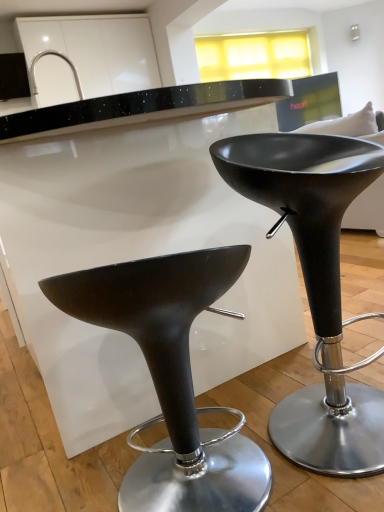
This screenshot has width=384, height=512. Describe the element at coordinates (172, 378) in the screenshot. I see `matte black stool at lower left, marked as the 1th stool in a left-to-right arrangement` at that location.

Image resolution: width=384 pixels, height=512 pixels. What are the coordinates of `matte black stool at center, acting as the second stool starting from the left` in the screenshot? It's located at (316, 286).

Identify the location of satin nickel faucet at upper left. The width and height of the screenshot is (384, 512). (56, 56).

The height and width of the screenshot is (512, 384). Find the location of `matte black stool at lower left, which ranks as the second stool in right-to-left order`. matte black stool at lower left, which ranks as the second stool in right-to-left order is located at coordinates (172, 378).

Is matte black stool at lower left, which ranks as the second stool in right-to-left order, aimed at satin nickel faucet at upper left?

No, matte black stool at lower left, which ranks as the second stool in right-to-left order, is not aimed at satin nickel faucet at upper left.

In terms of height, does matte black stool at lower left, marked as the 1th stool in a left-to-right arrangement, look taller or shorter compared to satin nickel faucet at upper left?

Clearly, matte black stool at lower left, marked as the 1th stool in a left-to-right arrangement, is taller compared to satin nickel faucet at upper left.

Is matte black stool at lower left, marked as the 1th stool in a left-to-right arrangement, in front of or behind satin nickel faucet at upper left in the image?

Clearly, matte black stool at lower left, marked as the 1th stool in a left-to-right arrangement, is in front of satin nickel faucet at upper left.

Can you confirm if matte black stool at lower left, marked as the 1th stool in a left-to-right arrangement, is smaller than satin nickel faucet at upper left?

No, matte black stool at lower left, marked as the 1th stool in a left-to-right arrangement, is not smaller than satin nickel faucet at upper left.

Is matte black stool at lower left, marked as the 1th stool in a left-to-right arrangement, beside matte black stool at center, the 1th stool in the right-to-left sequence?

No, matte black stool at lower left, marked as the 1th stool in a left-to-right arrangement, is not touching matte black stool at center, the 1th stool in the right-to-left sequence.

Considering the positions of objects matte black stool at lower left, marked as the 1th stool in a left-to-right arrangement, and matte black stool at center, acting as the second stool starting from the left, in the image provided, who is more to the right, matte black stool at lower left, marked as the 1th stool in a left-to-right arrangement, or matte black stool at center, acting as the second stool starting from the left,?

matte black stool at center, acting as the second stool starting from the left, is more to the right.

Is point (97, 324) closer to viewer compared to point (302, 224)?

Yes.

From the image's perspective, between matte black stool at lower left, marked as the 1th stool in a left-to-right arrangement, and matte black stool at center, the 1th stool in the right-to-left sequence, who is located below?

matte black stool at lower left, marked as the 1th stool in a left-to-right arrangement, from the image's perspective.

Is matte black stool at center, the 1th stool in the right-to-left sequence, not within satin nickel faucet at upper left?

Yes, matte black stool at center, the 1th stool in the right-to-left sequence, is located beyond the bounds of satin nickel faucet at upper left.

How many degrees apart are the facing directions of matte black stool at center, the 1th stool in the right-to-left sequence, and satin nickel faucet at upper left?

matte black stool at center, the 1th stool in the right-to-left sequence, and satin nickel faucet at upper left are facing 116 degrees away from each other.

How distant is matte black stool at center, acting as the second stool starting from the left, from satin nickel faucet at upper left?

matte black stool at center, acting as the second stool starting from the left, is 3.97 meters away from satin nickel faucet at upper left.

Between matte black stool at center, acting as the second stool starting from the left, and satin nickel faucet at upper left, which one appears on the right side from the viewer's perspective?

matte black stool at center, acting as the second stool starting from the left.

Which is closer, (32,68) or (331,253)?

Point (32,68) is positioned farther from the camera compared to point (331,253).

Is satin nickel faucet at upper left far from matte black stool at center, acting as the second stool starting from the left?

That's right, there is a large distance between satin nickel faucet at upper left and matte black stool at center, acting as the second stool starting from the left.

From a real-world perspective, between satin nickel faucet at upper left and matte black stool at center, the 1th stool in the right-to-left sequence, who is vertically higher?

In real-world perspective, satin nickel faucet at upper left is above.

Starting from the satin nickel faucet at upper left, which stool is the 1st one in front? Please provide its 2D coordinates.

[(316, 286)]

Is matte black stool at center, acting as the second stool starting from the left, not near matte black stool at lower left, marked as the 1th stool in a left-to-right arrangement?

They are positioned close to each other.

Find the location of a particular element. The height and width of the screenshot is (512, 384). stool above the matte black stool at lower left, which ranks as the second stool in right-to-left order (from the image's perspective) is located at coordinates (316, 286).

What's the angular difference between matte black stool at center, acting as the second stool starting from the left, and matte black stool at lower left, marked as the 1th stool in a left-to-right arrangement,'s facing directions?

There is a 110-degree angle between the facing directions of matte black stool at center, acting as the second stool starting from the left, and matte black stool at lower left, marked as the 1th stool in a left-to-right arrangement.

Does matte black stool at center, acting as the second stool starting from the left, appear on the left side of matte black stool at lower left, marked as the 1th stool in a left-to-right arrangement?

In fact, matte black stool at center, acting as the second stool starting from the left, is to the right of matte black stool at lower left, marked as the 1th stool in a left-to-right arrangement.

Is satin nickel faucet at upper left to the left or to the right of matte black stool at lower left, which ranks as the second stool in right-to-left order, in the image?

In the image, satin nickel faucet at upper left appears on the left side of matte black stool at lower left, which ranks as the second stool in right-to-left order.

From a real-world perspective, is satin nickel faucet at upper left on top of matte black stool at lower left, which ranks as the second stool in right-to-left order?

Correct, in the physical world, satin nickel faucet at upper left is higher than matte black stool at lower left, which ranks as the second stool in right-to-left order.

How much distance is there between satin nickel faucet at upper left and matte black stool at lower left, marked as the 1th stool in a left-to-right arrangement?

13.31 feet.

Does satin nickel faucet at upper left have a greater height compared to matte black stool at lower left, marked as the 1th stool in a left-to-right arrangement?

Incorrect, the height of satin nickel faucet at upper left is not larger of that of matte black stool at lower left, marked as the 1th stool in a left-to-right arrangement.

Image resolution: width=384 pixels, height=512 pixels. What are the coordinates of `faucet lying above the matte black stool at lower left, marked as the 1th stool in a left-to-right arrangement (from the image's perspective)` in the screenshot? It's located at (56, 56).

This screenshot has height=512, width=384. Find the location of `stool that appears on the left of matte black stool at center, the 1th stool in the right-to-left sequence`. stool that appears on the left of matte black stool at center, the 1th stool in the right-to-left sequence is located at coordinates (172, 378).

Considering their positions, is matte black stool at lower left, marked as the 1th stool in a left-to-right arrangement, positioned closer to satin nickel faucet at upper left than matte black stool at center, the 1th stool in the right-to-left sequence?

matte black stool at center, the 1th stool in the right-to-left sequence, is positioned closer to the anchor satin nickel faucet at upper left.

Which object lies nearer to the anchor point matte black stool at center, acting as the second stool starting from the left, matte black stool at lower left, which ranks as the second stool in right-to-left order, or satin nickel faucet at upper left?

matte black stool at lower left, which ranks as the second stool in right-to-left order, is positioned closer to the anchor matte black stool at center, acting as the second stool starting from the left.

Estimate the real-world distances between objects in this image. Which object is further from satin nickel faucet at upper left, matte black stool at center, the 1th stool in the right-to-left sequence, or matte black stool at lower left, marked as the 1th stool in a left-to-right arrangement?

matte black stool at lower left, marked as the 1th stool in a left-to-right arrangement, lies further to satin nickel faucet at upper left than the other object.

Based on their spatial positions, is satin nickel faucet at upper left or matte black stool at lower left, which ranks as the second stool in right-to-left order, closer to matte black stool at center, acting as the second stool starting from the left?

The object closer to matte black stool at center, acting as the second stool starting from the left, is matte black stool at lower left, which ranks as the second stool in right-to-left order.

Based on their spatial positions, is satin nickel faucet at upper left or matte black stool at center, acting as the second stool starting from the left, further from matte black stool at lower left, which ranks as the second stool in right-to-left order?

Based on the image, satin nickel faucet at upper left appears to be further to matte black stool at lower left, which ranks as the second stool in right-to-left order.

Considering their positions, is matte black stool at center, acting as the second stool starting from the left, positioned further to matte black stool at lower left, marked as the 1th stool in a left-to-right arrangement, than satin nickel faucet at upper left?

satin nickel faucet at upper left is positioned further to the anchor matte black stool at lower left, marked as the 1th stool in a left-to-right arrangement.

Locate an element on the screen. Image resolution: width=384 pixels, height=512 pixels. stool positioned between matte black stool at lower left, marked as the 1th stool in a left-to-right arrangement, and satin nickel faucet at upper left from near to far is located at coordinates (316, 286).